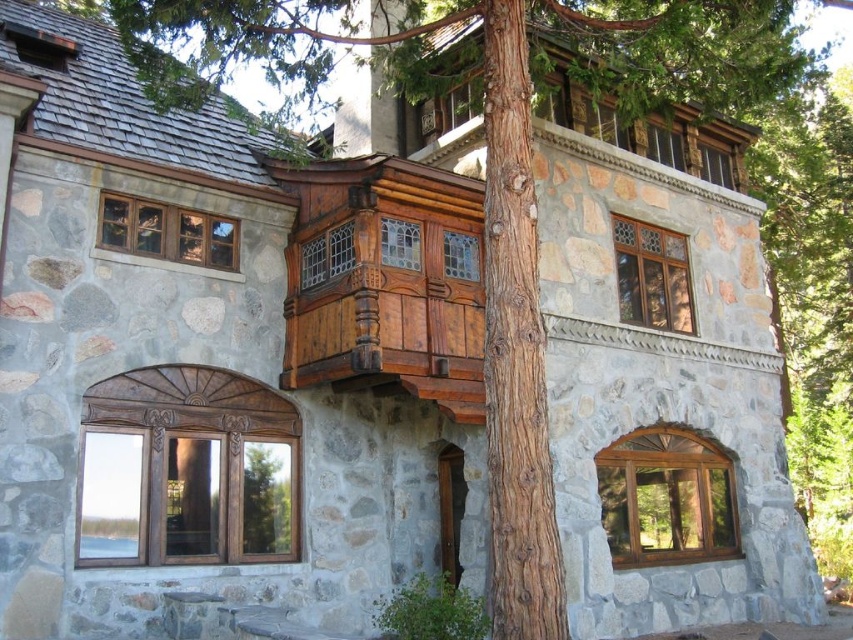
Question: Is brown rough bark at center smaller than wooden balcony at upper center?

Choices:
 (A) yes
 (B) no

Answer: (A)

Question: Where is brown rough bark at center located in relation to wooden balcony at upper center in the image?

Choices:
 (A) below
 (B) above

Answer: (A)

Question: Among these objects, which one is farthest from the camera?

Choices:
 (A) wooden balcony at upper center
 (B) brown rough bark at center

Answer: (A)

Question: Considering the relative positions of brown rough bark at center and wooden balcony at upper center in the image provided, where is brown rough bark at center located with respect to wooden balcony at upper center?

Choices:
 (A) right
 (B) left

Answer: (B)

Question: Among these objects, which one is nearest to the camera?

Choices:
 (A) brown rough bark at center
 (B) wooden balcony at upper center

Answer: (A)

Question: Which of the following is the closest to the observer?

Choices:
 (A) (498, 33)
 (B) (677, 109)

Answer: (A)